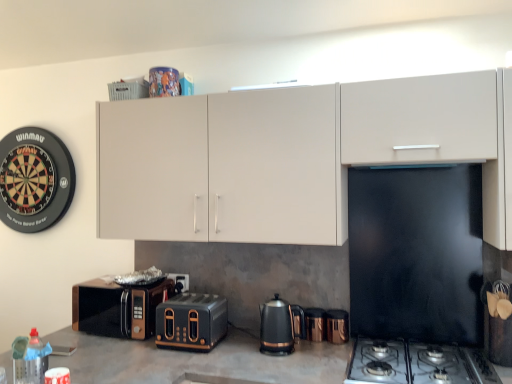
What is the approximate width of black metallic toaster at center?

black metallic toaster at center is 42.25 centimeters wide.

You are a GUI agent. You are given a task and a screenshot of the screen. Output one action in this format:
    pyautogui.click(x=<x>, y=<y>)
    Task: Click on the black metallic toaster at center
    
    Given the screenshot: What is the action you would take?
    pyautogui.click(x=191, y=321)

The image size is (512, 384). What are the coordinates of `metallic copper kettle at center, placed as the 2th appliance when sorted from right to left` in the screenshot? It's located at (315, 324).

Describe the element at coordinates (34, 179) in the screenshot. I see `black plastic dartboard at left` at that location.

Find the location of a particular element. This screenshot has width=512, height=384. black metallic toaster at center is located at coordinates (191, 321).

Is point (86, 287) in front of point (218, 217)?

That is False.

Looking at this image, considering the positions of objects bronze metallic microwave at lower left and matte white cabinet at upper center in the image provided, who is more to the left, bronze metallic microwave at lower left or matte white cabinet at upper center?

From the viewer's perspective, bronze metallic microwave at lower left appears more on the left side.

Is bronze metallic microwave at lower left positioned beyond the bounds of matte white cabinet at upper center?

Yes.

Does bronze metallic microwave at lower left turn towards matte white cabinet at upper center?

No, bronze metallic microwave at lower left is not facing towards matte white cabinet at upper center.

Which object is wider, metallic copper kettle at center, the first appliance positioned from the left, or copper metallic kettle at center, marked as the 2th appliance in a left-to-right arrangement?

metallic copper kettle at center, the first appliance positioned from the left.

Between metallic copper kettle at center, placed as the 2th appliance when sorted from right to left, and copper metallic kettle at center, acting as the first appliance starting from the right, which one appears on the left side from the viewer's perspective?

Positioned to the left is metallic copper kettle at center, placed as the 2th appliance when sorted from right to left.

Can you confirm if metallic copper kettle at center, the first appliance positioned from the left, is bigger than copper metallic kettle at center, marked as the 2th appliance in a left-to-right arrangement?

Actually, metallic copper kettle at center, the first appliance positioned from the left, might be smaller than copper metallic kettle at center, marked as the 2th appliance in a left-to-right arrangement.

Is copper metallic kettle at center, marked as the 2th appliance in a left-to-right arrangement, completely or partially inside metallic copper kettle at center, placed as the 2th appliance when sorted from right to left?

No, metallic copper kettle at center, placed as the 2th appliance when sorted from right to left, does not contain copper metallic kettle at center, marked as the 2th appliance in a left-to-right arrangement.

Where is `appliance that is the 2nd one when counting backward from the matte white cabinet at upper center`? This screenshot has width=512, height=384. appliance that is the 2nd one when counting backward from the matte white cabinet at upper center is located at coordinates (315, 324).

Which is correct: matte white cabinet at upper center is inside metallic copper kettle at center, the first appliance positioned from the left, or outside of it?

matte white cabinet at upper center lies outside metallic copper kettle at center, the first appliance positioned from the left.

How many degrees apart are the facing directions of matte white cabinet at upper center and metallic copper kettle at center, placed as the 2th appliance when sorted from right to left?

The angular difference between matte white cabinet at upper center and metallic copper kettle at center, placed as the 2th appliance when sorted from right to left, is 1.32 degrees.

Is matte white cabinet at upper center shorter than metallic copper kettle at center, the first appliance positioned from the left?

No, matte white cabinet at upper center is not shorter than metallic copper kettle at center, the first appliance positioned from the left.

Is black metallic toaster at center far from black plastic kettle at center?

No, black metallic toaster at center is not far from black plastic kettle at center.

From the image's perspective, does black metallic toaster at center appear higher than black plastic kettle at center?

No.

Between black metallic toaster at center and black plastic kettle at center, which one is positioned behind?

black metallic toaster at center.

From a real-world perspective, is metallic copper kettle at center, placed as the 2th appliance when sorted from right to left, beneath black metallic toaster at center?

Yes, from a real-world perspective, metallic copper kettle at center, placed as the 2th appliance when sorted from right to left, is under black metallic toaster at center.

From the picture: Which object is more forward, metallic copper kettle at center, the first appliance positioned from the left, or black metallic toaster at center?

black metallic toaster at center is in front.

Is point (319, 315) positioned after point (207, 324)?

Yes, point (319, 315) is behind point (207, 324).

Does point (57, 185) come farther from viewer compared to point (116, 324)?

Yes, it is behind point (116, 324).

From a real-world perspective, between black plastic dartboard at left and bronze metallic microwave at lower left, who is vertically lower?

From a 3D spatial view, bronze metallic microwave at lower left is below.

Which of these two, black plastic dartboard at left or bronze metallic microwave at lower left, is wider?

Wider between the two is bronze metallic microwave at lower left.

From a real-world perspective, which object stands above the other?

black plastic dartboard at left.

Can you confirm if copper metallic kettle at center, acting as the first appliance starting from the right, is bigger than black plastic dartboard at left?

Incorrect, copper metallic kettle at center, acting as the first appliance starting from the right, is not larger than black plastic dartboard at left.

Can you confirm if copper metallic kettle at center, marked as the 2th appliance in a left-to-right arrangement, is taller than black plastic dartboard at left?

In fact, copper metallic kettle at center, marked as the 2th appliance in a left-to-right arrangement, may be shorter than black plastic dartboard at left.

Locate an element on the screen. This screenshot has width=512, height=384. cabinetry that is on the right side of bronze metallic microwave at lower left is located at coordinates (292, 156).

What are the coordinates of `appliance that appears above the copper metallic kettle at center, acting as the first appliance starting from the right (from the image's perspective)` in the screenshot? It's located at (315, 324).

Looking at the image, which one is located further to metallic copper kettle at center, the first appliance positioned from the left, copper metallic kettle at center, acting as the first appliance starting from the right, or black plastic kettle at center?

Among the two, black plastic kettle at center is located further to metallic copper kettle at center, the first appliance positioned from the left.

Looking at this image, which object lies nearer to the anchor point matte white cabinet at upper center, bronze metallic microwave at lower left or black metallic gas stove at lower right?

Based on the image, bronze metallic microwave at lower left appears to be nearer to matte white cabinet at upper center.

Based on their spatial positions, is black plastic kettle at center or bronze metallic microwave at lower left closer to matte white cabinet at upper center?

black plastic kettle at center is positioned closer to the anchor matte white cabinet at upper center.

From the image, which object appears to be farther from black plastic dartboard at left, metallic copper kettle at center, the first appliance positioned from the left, or black plastic kettle at center?

Among the two, metallic copper kettle at center, the first appliance positioned from the left, is located further to black plastic dartboard at left.

Estimate the real-world distances between objects in this image. Which object is further from matte white cabinet at upper center, black metallic gas stove at lower right or bronze metallic microwave at lower left?

black metallic gas stove at lower right.

Which object lies nearer to the anchor point black metallic toaster at center, bronze metallic microwave at lower left or matte white cabinet at upper center?

bronze metallic microwave at lower left is positioned closer to the anchor black metallic toaster at center.

When comparing their distances from matte white cabinet at upper center, does metallic copper kettle at center, placed as the 2th appliance when sorted from right to left, or black metallic toaster at center seem further?

metallic copper kettle at center, placed as the 2th appliance when sorted from right to left.

Considering their positions, is copper metallic kettle at center, marked as the 2th appliance in a left-to-right arrangement, positioned closer to black plastic kettle at center than black plastic dartboard at left?

copper metallic kettle at center, marked as the 2th appliance in a left-to-right arrangement.

Find the location of a particular element. The width and height of the screenshot is (512, 384). cabinetry between bronze metallic microwave at lower left and metallic copper kettle at center, placed as the 2th appliance when sorted from right to left, in the horizontal direction is located at coordinates (292, 156).

Where is `appliance located between black metallic gas stove at lower right and metallic copper kettle at center, placed as the 2th appliance when sorted from right to left, in the depth direction`? appliance located between black metallic gas stove at lower right and metallic copper kettle at center, placed as the 2th appliance when sorted from right to left, in the depth direction is located at coordinates (337, 326).

Identify the location of cabinetry between black metallic toaster at center and black metallic gas stove at lower right from left to right. (292, 156).

This screenshot has height=384, width=512. In order to click on home appliance located between black plastic dartboard at left and black metallic toaster at center in the left-right direction in this screenshot , I will do `click(118, 308)`.